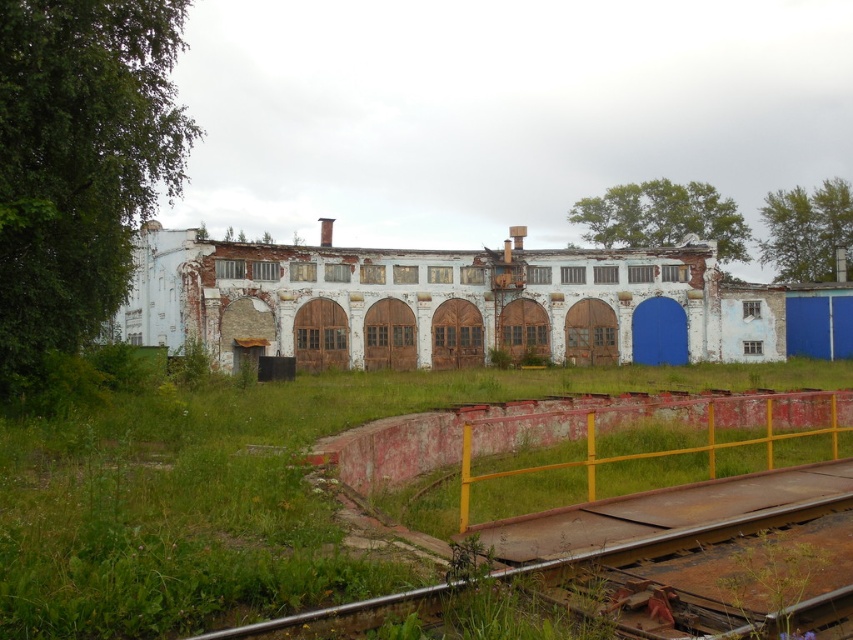
Who is taller, rusty metal rail at lower right or green leafy weed at lower right?

rusty metal rail at lower right

Who is positioned more to the left, rusty metal rail at lower right or green leafy weed at lower right?

green leafy weed at lower right is more to the left.

Is point (790, 432) farther from camera compared to point (775, 612)?

Yes.

What are the coordinates of `rusty metal rail at lower right` in the screenshot? It's located at pyautogui.click(x=683, y=420).

Between rusty metal train track at lower center and green leafy weed at lower right, which one has more height?

With more height is rusty metal train track at lower center.

Is point (653, 541) farther from camera compared to point (764, 576)?

Yes, point (653, 541) is behind point (764, 576).

Is point (715, 534) farther from viewer compared to point (729, 579)?

Yes, it is behind point (729, 579).

What are the coordinates of `rusty metal train track at lower center` in the screenshot? It's located at (676, 536).

Is rusty metal rail at lower right above rusty metal train track at lower center?

Yes.

Based on the photo, does rusty metal rail at lower right have a lesser height compared to rusty metal train track at lower center?

In fact, rusty metal rail at lower right may be taller than rusty metal train track at lower center.

Between point (822, 413) and point (589, 556), which one is positioned behind?

The point (822, 413) is more distant.

Locate an element on the screen. rusty metal rail at lower right is located at coordinates (683, 420).